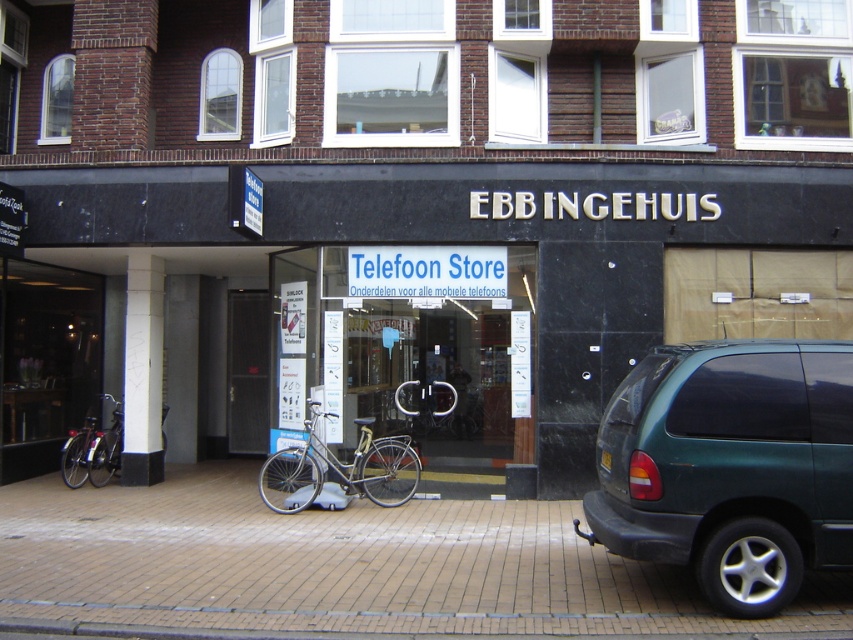
The image size is (853, 640). Describe the element at coordinates (398, 291) in the screenshot. I see `black glass storefront at center` at that location.

In the scene shown: Is black glass storefront at center smaller than silver metallic bicycle at center?

Incorrect, black glass storefront at center is not smaller in size than silver metallic bicycle at center.

Does point (328, 173) come in front of point (352, 490)?

No, it is not.

At what (x,y) coordinates should I click in order to perform the action: click on black glass storefront at center. Please return your answer as a coordinate pair (x, y). Image resolution: width=853 pixels, height=640 pixels. Looking at the image, I should click on (398, 291).

Between silver metallic bicycle at center and shiny metallic bicycle at left, which one is positioned higher?

silver metallic bicycle at center is above.

Between point (408, 440) and point (117, 401), which one is positioned in front?

Point (408, 440) is in front.

Which is in front, point (412, 490) or point (84, 460)?

Positioned in front is point (412, 490).

You are a GUI agent. You are given a task and a screenshot of the screen. Output one action in this format:
    pyautogui.click(x=<x>, y=<y>)
    Task: Click on the silver metallic bicycle at center
    
    Given the screenshot: What is the action you would take?
    pyautogui.click(x=339, y=468)

At what (x,y) coordinates should I click in order to perform the action: click on green matte suv at right. Please return your answer as a coordinate pair (x, y). The width and height of the screenshot is (853, 640). Looking at the image, I should click on (730, 467).

Is green matte suv at right below silver metallic bicycle at center?

Actually, green matte suv at right is above silver metallic bicycle at center.

Between point (689, 348) and point (274, 464), which one is positioned behind?

The point (274, 464) is behind.

Locate an element on the screen. green matte suv at right is located at coordinates (730, 467).